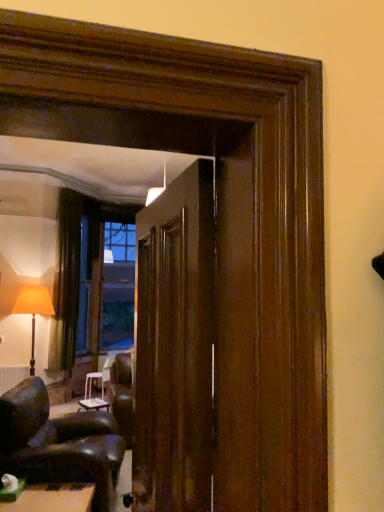
Question: Can you see white matte radiator at lower left touching glossy wood door at center?

Choices:
 (A) no
 (B) yes

Answer: (A)

Question: Can you confirm if white matte radiator at lower left is positioned to the left of glossy wood door at center?

Choices:
 (A) yes
 (B) no

Answer: (A)

Question: From a real-world perspective, is white matte radiator at lower left on top of glossy wood door at center?

Choices:
 (A) yes
 (B) no

Answer: (B)

Question: Is the position of white matte radiator at lower left less distant than that of glossy wood door at center?

Choices:
 (A) yes
 (B) no

Answer: (B)

Question: From the image's perspective, would you say white matte radiator at lower left is shown under glossy wood door at center?

Choices:
 (A) no
 (B) yes

Answer: (B)

Question: Can you confirm if white matte radiator at lower left is smaller than glossy wood door at center?

Choices:
 (A) no
 (B) yes

Answer: (B)

Question: Considering the relative positions of white matte radiator at lower left and matte orange fabric lampshade at left in the image provided, is white matte radiator at lower left to the right of matte orange fabric lampshade at left from the viewer's perspective?

Choices:
 (A) no
 (B) yes

Answer: (A)

Question: Can we say white matte radiator at lower left lies outside matte orange fabric lampshade at left?

Choices:
 (A) no
 (B) yes

Answer: (A)

Question: Does white matte radiator at lower left come in front of matte orange fabric lampshade at left?

Choices:
 (A) no
 (B) yes

Answer: (A)

Question: Does white matte radiator at lower left have a larger size compared to matte orange fabric lampshade at left?

Choices:
 (A) no
 (B) yes

Answer: (A)

Question: Considering the relative positions of white matte radiator at lower left and matte orange fabric lampshade at left in the image provided, is white matte radiator at lower left behind matte orange fabric lampshade at left?

Choices:
 (A) no
 (B) yes

Answer: (B)

Question: From a real-world perspective, is white matte radiator at lower left located beneath matte orange fabric lampshade at left?

Choices:
 (A) yes
 (B) no

Answer: (A)

Question: Is leather armchair at lower left completely or partially inside green felt table at lower left, positioned as the first table in front-to-back order?

Choices:
 (A) no
 (B) yes

Answer: (A)